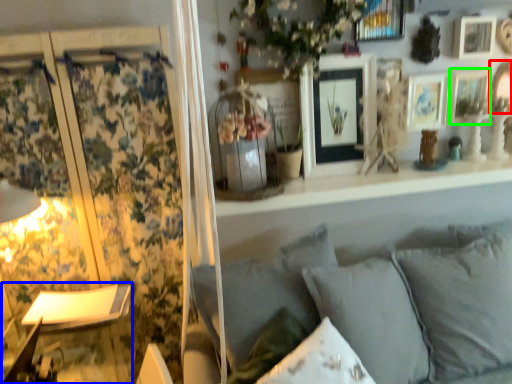
Question: Which object is the closest to the picture frame (highlighted by a red box)? Choose among these: table lamp (highlighted by a blue box) or picture frame (highlighted by a green box).

Choices:
 (A) table lamp
 (B) picture frame

Answer: (B)